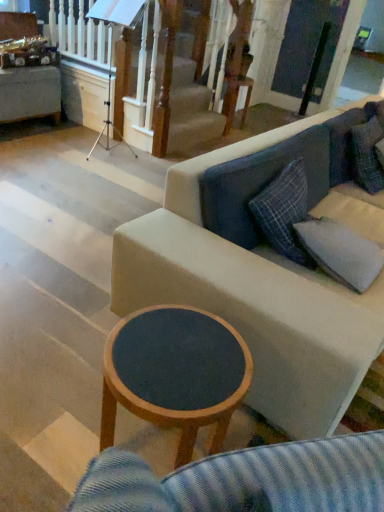
You are a GUI agent. You are given a task and a screenshot of the screen. Output one action in this format:
    pyautogui.click(x=<x>, y=<y>)
    Task: Click on the wooden round table at upper center
    The width and height of the screenshot is (384, 512).
    Given the screenshot: What is the action you would take?
    tap(235, 99)

Find the location of a particular element. This screenshot has height=512, width=384. studio couch located above the gray fabric pillow at right (from the image's perspective) is located at coordinates (255, 298).

Can you tell me how much gray fabric pillow at right and fabric couch at center differ in facing direction?

0.443 degrees.

Is the position of gray fabric pillow at right more distant than that of fabric couch at center?

Yes, the depth of gray fabric pillow at right is greater than that of fabric couch at center.

Is gray fabric pillow at right oriented away from fabric couch at center?

Absolutely, gray fabric pillow at right is directed away from fabric couch at center.

From the image's perspective, which is below, gray fabric pillow at right or wooden round table at upper center?

gray fabric pillow at right, from the image's perspective.

Is gray fabric pillow at right positioned with its back to wooden round table at upper center?

No, gray fabric pillow at right's orientation is not away from wooden round table at upper center.

Is gray fabric pillow at right inside or outside of wooden round table at upper center?

gray fabric pillow at right is spatially situated outside wooden round table at upper center.

From a real-world perspective, does gray fabric pillow at right sit lower than wooden round table at upper center?

Incorrect, from a real-world perspective, gray fabric pillow at right is higher than wooden round table at upper center.

Based on the photo, how much distance is there between wooden round table at center and fabric couch at center?

A distance of 42.67 centimeters exists between wooden round table at center and fabric couch at center.

Is wooden round table at center inside the boundaries of fabric couch at center, or outside?

The correct answer is: outside.

Is the depth of wooden round table at center less than that of fabric couch at center?

Yes, wooden round table at center is in front of fabric couch at center.

In the scene shown: Does wooden round table at center have a smaller size compared to fabric couch at center?

Indeed, wooden round table at center has a smaller size compared to fabric couch at center.

From the image's perspective, between gray fabric pillow at right and wooden round table at center, who is located below?

wooden round table at center appears lower in the image.

Is gray fabric pillow at right positioned behind wooden round table at center?

Yes, it is.

Considering the relative sizes of gray fabric pillow at right and wooden round table at center in the image provided, is gray fabric pillow at right bigger than wooden round table at center?

No.

Is gray fabric pillow at right far away from wooden round table at center?

No, gray fabric pillow at right is not far from wooden round table at center.

Is wooden round table at upper center aimed at wooden round table at center?

No, wooden round table at upper center is not turned towards wooden round table at center.

Which object is closer to the camera taking this photo, wooden round table at upper center or wooden round table at center?

wooden round table at center is in front.

From the image's perspective, which is above, wooden round table at upper center or wooden round table at center?

From the image's view, wooden round table at upper center is above.

Is fabric couch at center oriented away from wooden round table at center?

fabric couch at center is not turned away from wooden round table at center.

Which is in front, point (223, 288) or point (240, 351)?

The point (240, 351) is more forward.

Identify the location of studio couch above the wooden round table at center (from a real-world perspective). (255, 298).

Is wooden round table at center in contact with gray fabric pillow at right?

wooden round table at center is not next to gray fabric pillow at right, and they're not touching.

Is point (162, 423) closer to camera compared to point (357, 263)?

Yes, it is.

This screenshot has width=384, height=512. I want to click on pillow above the wooden round table at center (from the image's perspective), so click(341, 252).

Does wooden round table at center appear on the left side of gray fabric pillow at right?

Indeed, wooden round table at center is positioned on the left side of gray fabric pillow at right.

Where is `pillow behind the fabric couch at center`? Image resolution: width=384 pixels, height=512 pixels. pillow behind the fabric couch at center is located at coordinates (341, 252).

Image resolution: width=384 pixels, height=512 pixels. I want to click on pillow on the right of wooden round table at upper center, so click(x=341, y=252).

Estimate the real-world distances between objects in this image. Which object is further from wooden round table at upper center, fabric couch at center or wooden round table at center?

The object further to wooden round table at upper center is wooden round table at center.

Estimate the real-world distances between objects in this image. Which object is closer to wooden round table at center, wooden round table at upper center or gray fabric pillow at right?

The object closer to wooden round table at center is gray fabric pillow at right.

In the scene shown: Estimate the real-world distances between objects in this image. Which object is further from fabric couch at center, wooden round table at center or gray fabric pillow at right?

The object further to fabric couch at center is wooden round table at center.

From the image, which object appears to be nearer to fabric couch at center, wooden round table at upper center or wooden round table at center?

Based on the image, wooden round table at center appears to be nearer to fabric couch at center.

Which object lies nearer to the anchor point wooden round table at center, gray fabric pillow at right or fabric couch at center?

The object closer to wooden round table at center is fabric couch at center.

Based on the photo, looking at the image, which one is located further to wooden round table at center, wooden round table at upper center or fabric couch at center?

wooden round table at upper center lies further to wooden round table at center than the other object.

Which object lies further to the anchor point wooden round table at upper center, gray fabric pillow at right or wooden round table at center?

wooden round table at center.

Which object lies further to the anchor point fabric couch at center, gray fabric pillow at right or wooden round table at upper center?

wooden round table at upper center lies further to fabric couch at center than the other object.

The width and height of the screenshot is (384, 512). I want to click on pillow between wooden round table at center and wooden round table at upper center along the z-axis, so click(341, 252).

The height and width of the screenshot is (512, 384). I want to click on studio couch located between wooden round table at center and wooden round table at upper center in the depth direction, so click(255, 298).

Where is `pillow between wooden round table at center and fabric couch at center`? This screenshot has height=512, width=384. pillow between wooden round table at center and fabric couch at center is located at coordinates (341, 252).

Locate an element on the screen. The width and height of the screenshot is (384, 512). pillow between fabric couch at center and wooden round table at upper center along the z-axis is located at coordinates (341, 252).